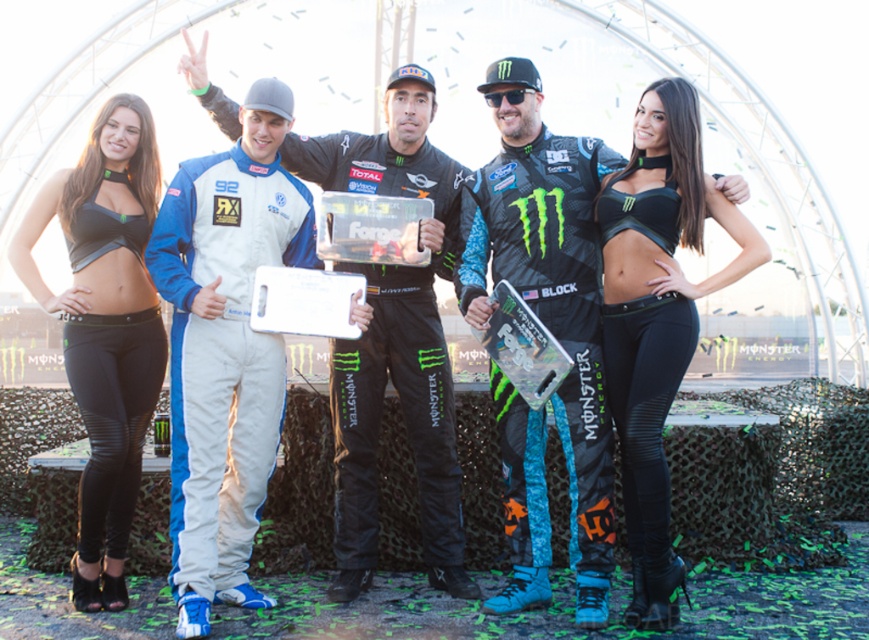
You are a photographer at the event and need to adjust the camera focus. Since the white fabric racing suit at center and the black matte sports bra at center are both in the frame, which one should you focus on first to ensure proper depth of field?

The white fabric racing suit at center is taller than the black matte sports bra at center, so you should focus on the white fabric racing suit at center first to account for its greater height in the frame.

You are a photographer at the event and need to ensure all participants are visible in the photo. Given the white fabric racing suit at center and the matte black sports bra at left, which one might appear more prominent in the photo?

The white fabric racing suit at center is larger in size than the matte black sports bra at left, so it will appear more prominent in the photo.

You are a photographer at the event and need to adjust the camera frame to ensure both the white fabric racing suit at center and the black matte sports bra at center are fully visible. Which object requires a wider frame to accommodate its size?

The white fabric racing suit at center requires a wider frame because its width surpasses that of the black matte sports bra at center.